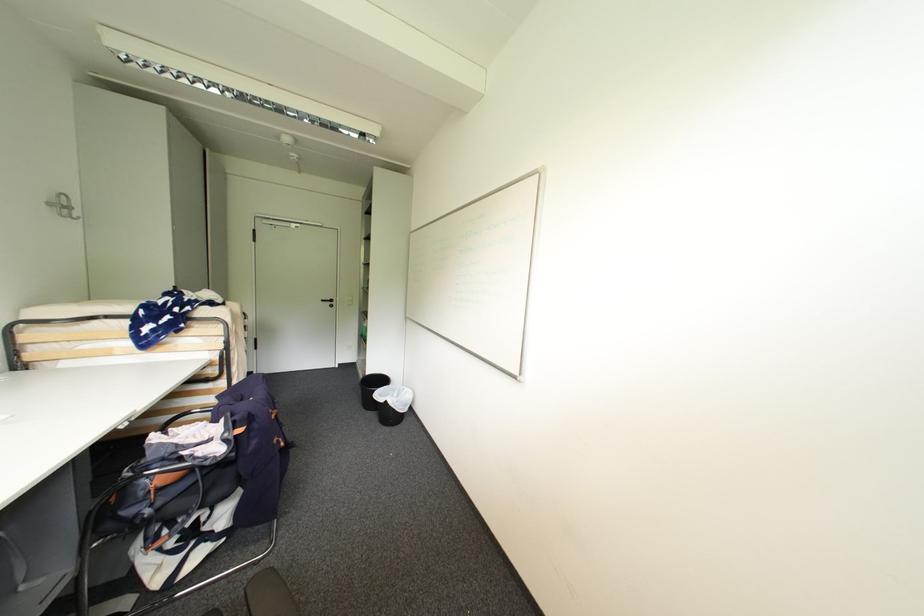
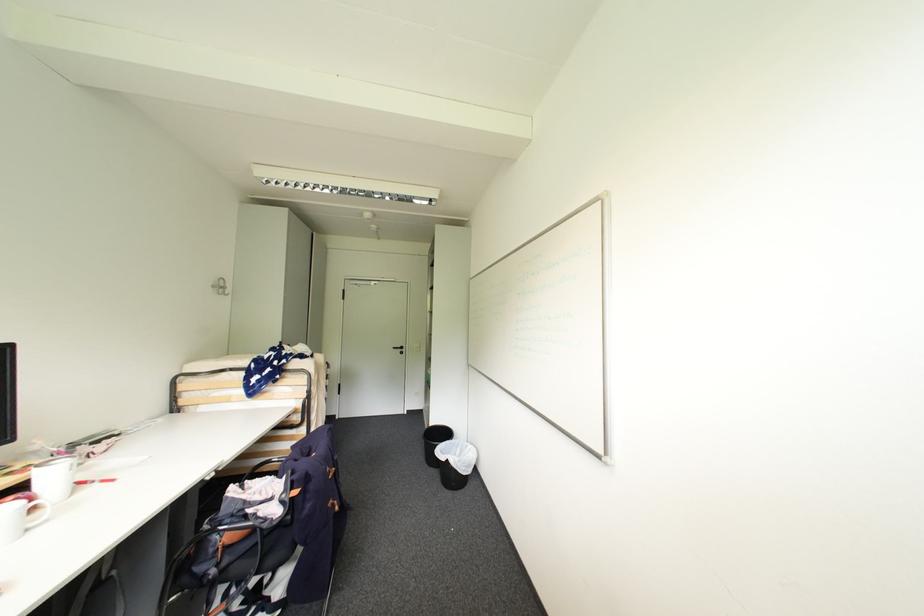
The point at [330,302] is marked in the first image. Where is the corresponding point in the second image?

(400, 349)